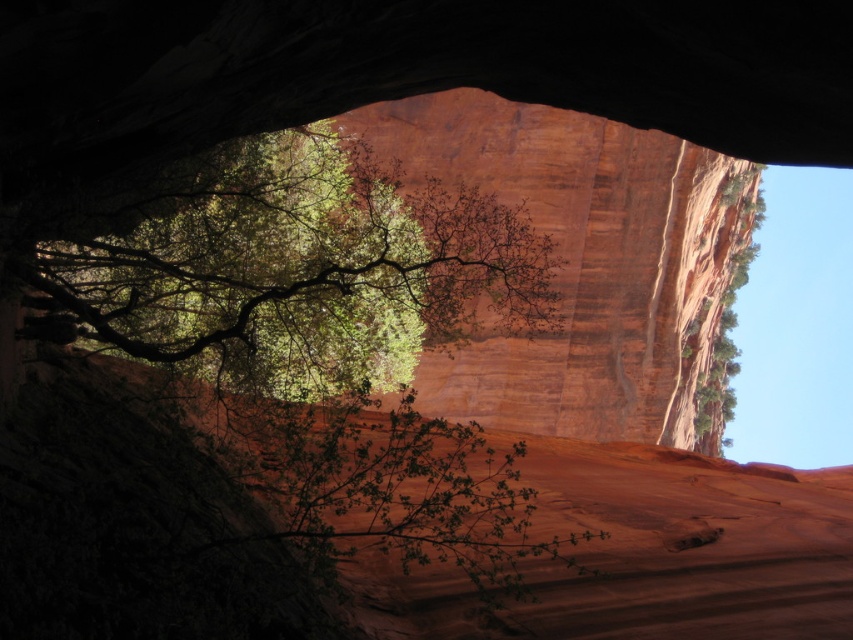
Question: Can you confirm if green leafy tree at center is positioned below green leafy tree at upper right?

Choices:
 (A) no
 (B) yes

Answer: (A)

Question: Does green leafy tree at center have a larger size compared to green leafy tree at upper right?

Choices:
 (A) no
 (B) yes

Answer: (A)

Question: Among these objects, which one is nearest to the camera?

Choices:
 (A) green leafy tree at center
 (B) green leafy tree at upper right

Answer: (A)

Question: Which of the following is the closest to the observer?

Choices:
 (A) green leafy tree at center
 (B) green leafy tree at upper right

Answer: (A)

Question: Can you confirm if green leafy tree at center is positioned to the right of green leafy tree at upper right?

Choices:
 (A) no
 (B) yes

Answer: (A)